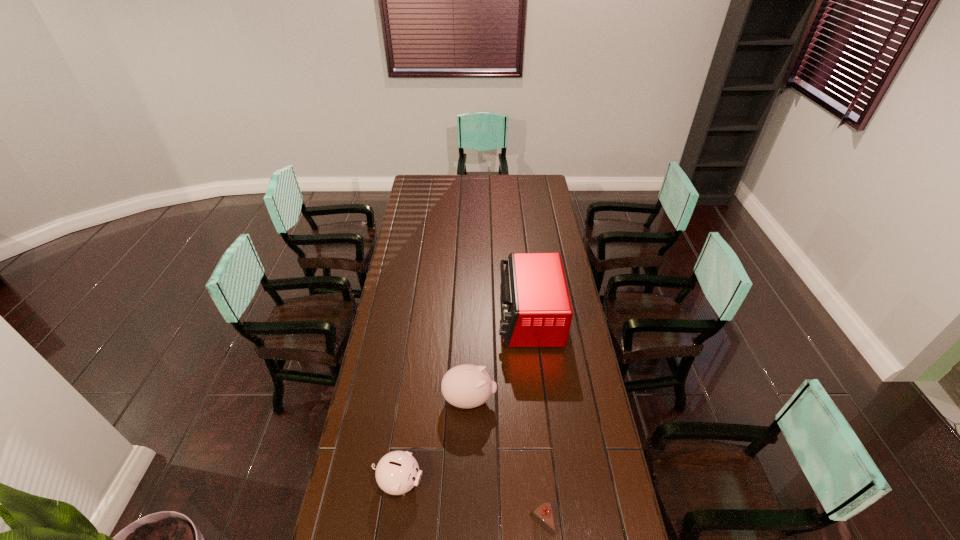
Find the location of `unoccupied position between the chocolate cake and the left piggy bank`. unoccupied position between the chocolate cake and the left piggy bank is located at coordinates [470, 502].

At what (x,y) coordinates should I click in order to perform the action: click on free area in between the tallest object and the second tallest object. Please return your answer as a coordinate pair (x, y). The width and height of the screenshot is (960, 540). Looking at the image, I should click on (499, 359).

Identify the location of unoccupied area between the second shortest object and the shortest object. This screenshot has width=960, height=540. (470, 502).

The image size is (960, 540). I want to click on free space between the nearest object and the second shortest object, so click(470, 502).

I want to click on free space between the second object from left to right and the shortest object, so click(x=506, y=461).

Select which object is the closest to the farthest object. Please provide its 2D coordinates. Your answer should be formatted as a tuple, i.e. [(x, y)], where the tuple contains the x and y coordinates of a point satisfying the conditions above.

[(466, 386)]

The width and height of the screenshot is (960, 540). I want to click on object that stands as the third closest to the chocolate cake, so click(x=536, y=308).

Locate an element on the screen. The width and height of the screenshot is (960, 540). vacant point that satisfies the following two spatial constraints: 1. on the front side of the nearest object; 2. on the right side of the nearer piggy bank is located at coordinates (394, 523).

In order to click on free space that satisfies the following two spatial constraints: 1. on the front-facing side of the toaster oven; 2. on the front side of the left piggy bank in this screenshot , I will do `click(547, 482)`.

Find the location of a particular element. free point that satisfies the following two spatial constraints: 1. at the snout of the taller piggy bank; 2. on the back side of the nearest object is located at coordinates [x=467, y=523].